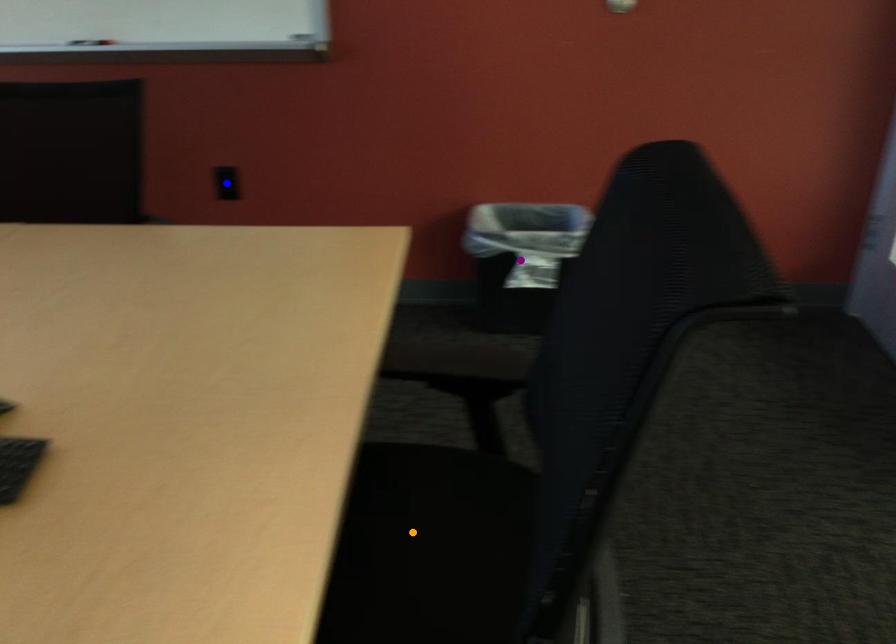
Order these from nearest to farthest:
blue point
purple point
orange point

orange point
purple point
blue point